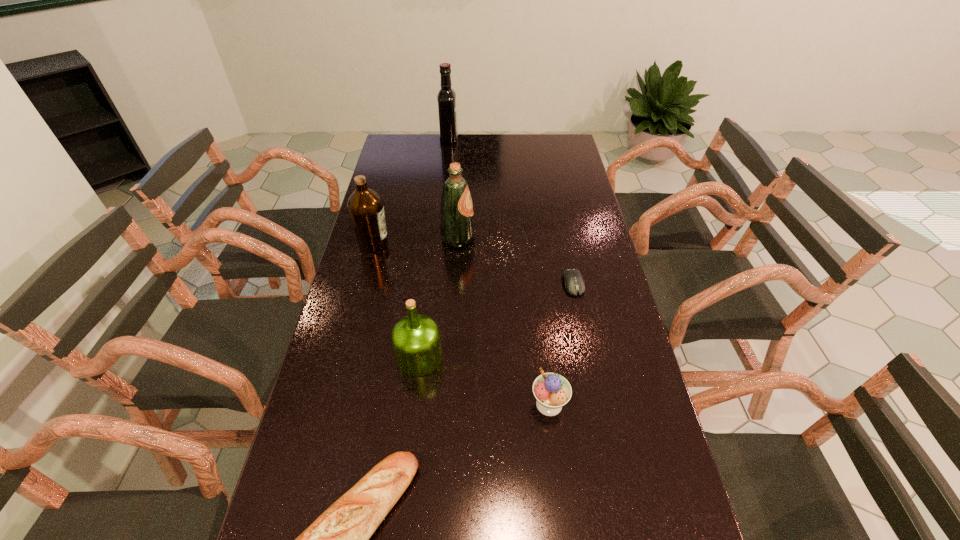
This screenshot has height=540, width=960. I want to click on vacant point located between the liquor and the shortest object, so click(x=511, y=212).

This screenshot has width=960, height=540. Find the location of `free spot between the farthest object and the third nearest object`. free spot between the farthest object and the third nearest object is located at coordinates (434, 248).

Where is `free space between the leftmost olive oil and the fourth nearest object`? The image size is (960, 540). free space between the leftmost olive oil and the fourth nearest object is located at coordinates (473, 264).

Identify the location of blank region between the liquor and the leftmost olive oil. (411, 192).

Where is `the closest object to the leftmost olive oil`? the closest object to the leftmost olive oil is located at coordinates (457, 227).

Identify which object is the second nearest to the farthest object. Please provide its 2D coordinates. Your answer should be formatted as a tuple, i.e. [(x, y)], where the tuple contains the x and y coordinates of a point satisfying the conditions above.

[(366, 209)]

Find the location of a particular element. This screenshot has height=540, width=960. olive oil that stands as the second closest to the fourth tallest object is located at coordinates (457, 227).

The width and height of the screenshot is (960, 540). I want to click on olive oil that stands as the third closest to the liquor, so click(x=416, y=341).

Find the location of a particular element. Image resolution: width=960 pixels, height=540 pixels. free region that satisfies the following two spatial constraints: 1. on the label of the nearest olive oil; 2. on the left side of the leftmost olive oil is located at coordinates (345, 357).

What are the coordinates of `vacant space that satisfies the following two spatial constraints: 1. on the front-facing side of the farthest object; 2. on the left side of the rightmost object` in the screenshot? It's located at (434, 284).